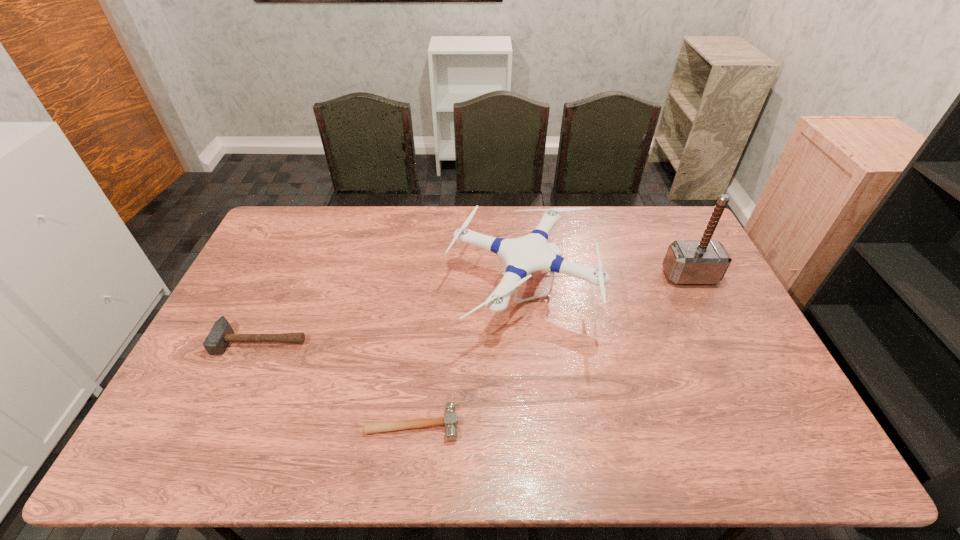
Where is `vacant point located between the third tallest object and the shortest hammer`? This screenshot has height=540, width=960. vacant point located between the third tallest object and the shortest hammer is located at coordinates (337, 382).

The image size is (960, 540). Identify the location of free spot between the third shortest object and the shortest object. (468, 357).

The image size is (960, 540). Find the location of `vacant space that's between the drone and the second shortest hammer`. vacant space that's between the drone and the second shortest hammer is located at coordinates tap(392, 315).

You are a GUI agent. You are given a task and a screenshot of the screen. Output one action in this format:
    pyautogui.click(x=<x>, y=<y>)
    Task: Click on the free spot between the farthest hammer and the nearest hammer
    
    Given the screenshot: What is the action you would take?
    pyautogui.click(x=551, y=350)

Find the location of a particular element. unoccupied area between the second shortest object and the tallest object is located at coordinates (475, 308).

This screenshot has height=540, width=960. I want to click on free space between the tallest hammer and the second hammer from right to left, so click(551, 350).

Where is `empty space between the nearest object and the second tallest object`? empty space between the nearest object and the second tallest object is located at coordinates (468, 357).

Locate an element on the screen. object that ranks as the closest to the third tallest object is located at coordinates (450, 420).

Choose which object is the nearest neighbor to the nearest object. Please provide its 2D coordinates. Your answer should be formatted as a tuple, i.e. [(x, y)], where the tuple contains the x and y coordinates of a point satisfying the conditions above.

[(525, 255)]

Locate which hammer is the closest to the tallest hammer. Please provide its 2D coordinates. Your answer should be formatted as a tuple, i.e. [(x, y)], where the tuple contains the x and y coordinates of a point satisfying the conditions above.

[(450, 420)]